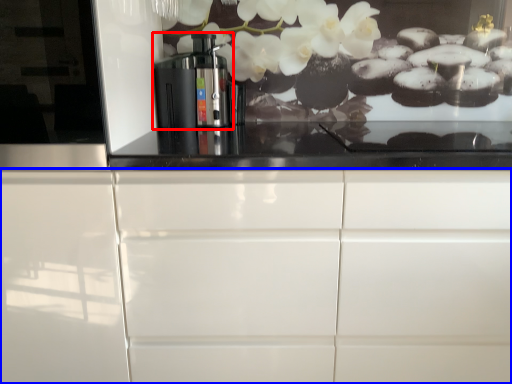
Question: Which point is further to the camera, home appliance (highlighted by a red box) or cabinetry (highlighted by a blue box)?

Choices:
 (A) home appliance
 (B) cabinetry

Answer: (A)